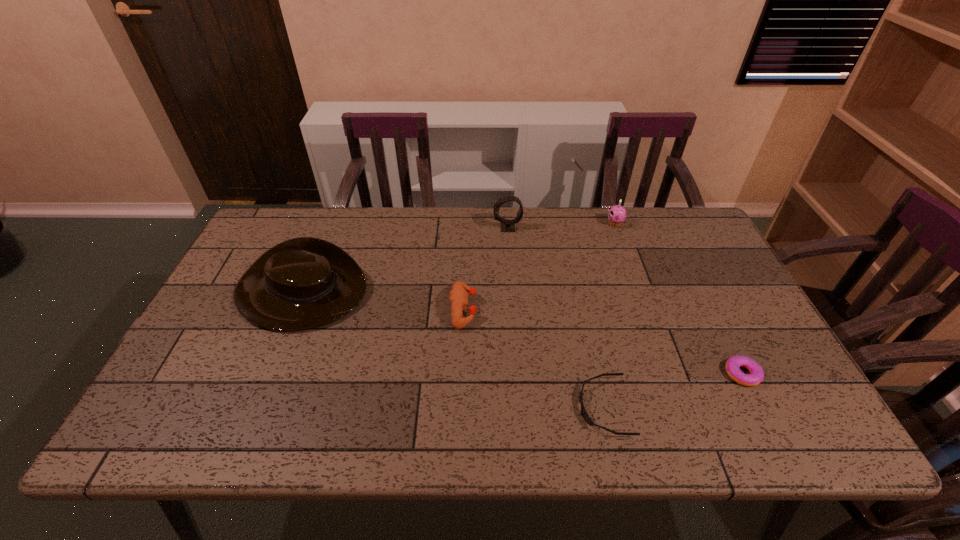
Where is `free spot located on the face of the fourth object from right to left`? This screenshot has width=960, height=540. free spot located on the face of the fourth object from right to left is located at coordinates (475, 228).

Where is `vacant space located 0.180m on the face of the fourth object from right to left`? This screenshot has height=540, width=960. vacant space located 0.180m on the face of the fourth object from right to left is located at coordinates (439, 228).

Locate an element on the screen. vacant point located on the face of the cupcake is located at coordinates coord(567,224).

Locate an element on the screen. The height and width of the screenshot is (540, 960). free space located on the face of the cupcake is located at coordinates (523, 224).

The height and width of the screenshot is (540, 960). In order to click on vacant region located 0.320m on the face of the cupcake in this screenshot , I will do `click(511, 224)`.

Image resolution: width=960 pixels, height=540 pixels. What are the coordinates of `vacant position located on the front of the leftmost object` in the screenshot? It's located at (259, 395).

Where is `vacant space situated 0.240m with the gloves of the third shortest object facing forward`? This screenshot has height=540, width=960. vacant space situated 0.240m with the gloves of the third shortest object facing forward is located at coordinates (564, 309).

The image size is (960, 540). I want to click on vacant space situated on the back of the doughnut, so click(696, 283).

Where is `vacant point located 0.230m on the front-facing side of the fourth object from left to right`? vacant point located 0.230m on the front-facing side of the fourth object from left to right is located at coordinates (478, 407).

Locate an element on the screen. vacant space located 0.140m on the front-facing side of the fourth object from left to right is located at coordinates (517, 407).